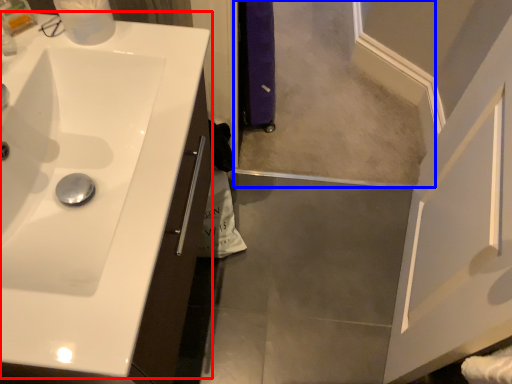
Question: Which point is further to the camera, sink (highlighted by a red box) or mirror (highlighted by a blue box)?

Choices:
 (A) sink
 (B) mirror

Answer: (B)